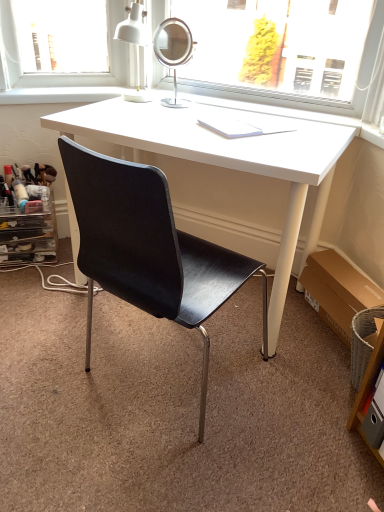
At what (x,y) coordinates should I click in order to perform the action: click on free space to the left of black leather chair at center. Please return your answer as a coordinate pair (x, y). Looking at the image, I should click on (41, 351).